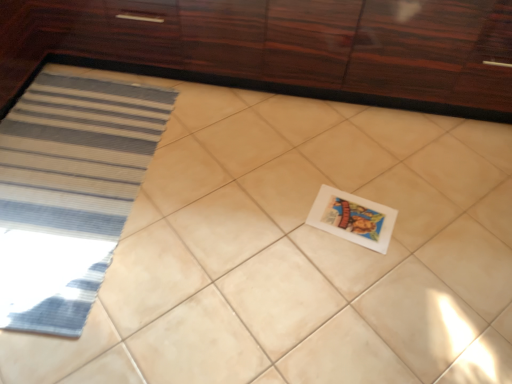
Question: Is glossy wood cabinetry at upper center next to white matte postcard at center and touching it?

Choices:
 (A) no
 (B) yes

Answer: (A)

Question: Would you say glossy wood cabinetry at upper center contains white matte postcard at center?

Choices:
 (A) yes
 (B) no

Answer: (B)

Question: Is glossy wood cabinetry at upper center bigger than white matte postcard at center?

Choices:
 (A) yes
 (B) no

Answer: (A)

Question: Are glossy wood cabinetry at upper center and white matte postcard at center located far from each other?

Choices:
 (A) no
 (B) yes

Answer: (A)

Question: Does glossy wood cabinetry at upper center appear on the left side of white matte postcard at center?

Choices:
 (A) no
 (B) yes

Answer: (B)

Question: From a real-world perspective, is glossy wood cabinetry at upper center located beneath white matte postcard at center?

Choices:
 (A) yes
 (B) no

Answer: (B)

Question: Is white matte postcard at center completely or partially outside of glossy wood cabinetry at upper center?

Choices:
 (A) no
 (B) yes

Answer: (B)

Question: Does white matte postcard at center turn towards glossy wood cabinetry at upper center?

Choices:
 (A) no
 (B) yes

Answer: (B)

Question: Would you say white matte postcard at center is a long distance from glossy wood cabinetry at upper center?

Choices:
 (A) no
 (B) yes

Answer: (A)

Question: Is white matte postcard at center oriented away from glossy wood cabinetry at upper center?

Choices:
 (A) no
 (B) yes

Answer: (A)

Question: Can you confirm if white matte postcard at center is positioned to the right of glossy wood cabinetry at upper center?

Choices:
 (A) no
 (B) yes

Answer: (B)

Question: Is white matte postcard at center smaller than glossy wood cabinetry at upper center?

Choices:
 (A) no
 (B) yes

Answer: (B)

Question: From the image's perspective, is glossy wood cabinetry at upper center positioned above or below white matte postcard at center?

Choices:
 (A) above
 (B) below

Answer: (A)